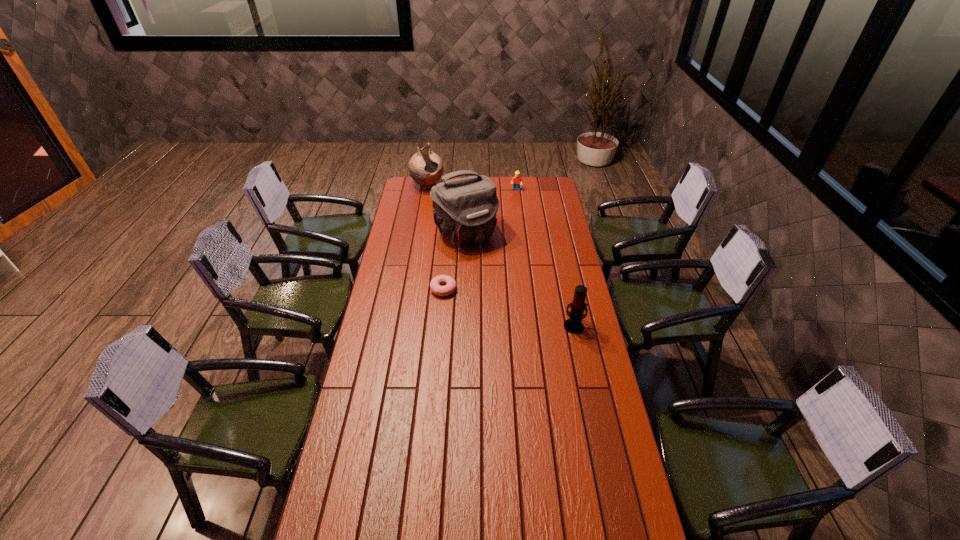
I want to click on blank region between the pottery and the microphone, so click(501, 256).

The image size is (960, 540). I want to click on empty location between the second nearest object and the pottery, so coord(436,238).

Where is `vacant space that's between the shoulder bag and the doughnut`? The height and width of the screenshot is (540, 960). vacant space that's between the shoulder bag and the doughnut is located at coordinates (454, 262).

This screenshot has width=960, height=540. In order to click on free space between the doughnut and the third nearest object in this screenshot , I will do `click(454, 262)`.

Identify the location of free space between the third tallest object and the fourth farthest object. Image resolution: width=960 pixels, height=540 pixels. (509, 308).

Identify the location of free space between the tallest object and the shortest object. The image size is (960, 540). (454, 262).

Identify the location of free space between the third tallest object and the shoulder bag. (520, 280).

Where is `object that stands as the fourth closest to the fourth shortest object`? object that stands as the fourth closest to the fourth shortest object is located at coordinates (573, 325).

Select which object appears as the second closest to the pottery. Please provide its 2D coordinates. Your answer should be formatted as a tuple, i.e. [(x, y)], where the tuple contains the x and y coordinates of a point satisfying the conditions above.

[(517, 180)]

I want to click on free spot that satisfies the following two spatial constraints: 1. on the front side of the third tallest object; 2. on the right side of the fourth farthest object, so click(441, 326).